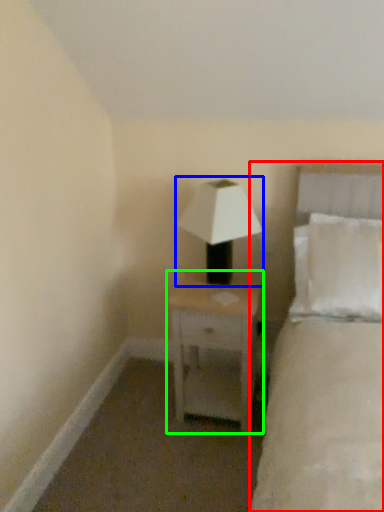
Question: Which object is positioned farthest from bed (highlighted by a red box)? Select from lamp (highlighted by a blue box) and nightstand (highlighted by a green box).

Choices:
 (A) lamp
 (B) nightstand

Answer: (A)